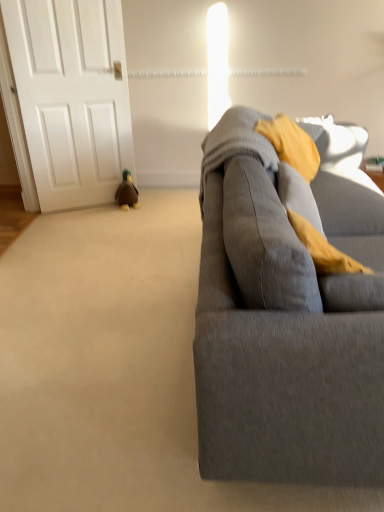
Question: Visually, is gray fabric couch at right positioned to the left or to the right of brown plush duck at lower left?

Choices:
 (A) right
 (B) left

Answer: (A)

Question: From a real-world perspective, is gray fabric couch at right physically located above or below brown plush duck at lower left?

Choices:
 (A) above
 (B) below

Answer: (A)

Question: Which is nearer to the white matte door at left?

Choices:
 (A) brown plush duck at lower left
 (B) gray fabric couch at right

Answer: (A)

Question: Based on their relative distances, which object is farther from the brown plush duck at lower left?

Choices:
 (A) white matte door at left
 (B) gray fabric couch at right

Answer: (B)